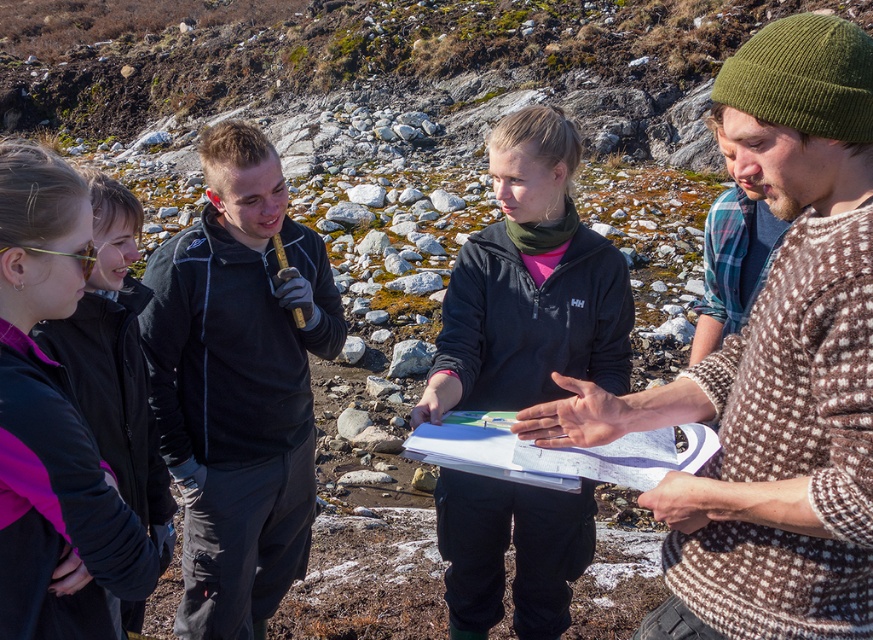
Question: Which of these objects is positioned closest to the gray rough rock at center?

Choices:
 (A) brown knitted hat at upper right
 (B) black fleece jacket at center

Answer: (B)

Question: Is black fleece jacket at center further to the viewer compared to dark blue fleece jacket at center?

Choices:
 (A) yes
 (B) no

Answer: (A)

Question: Can you confirm if brown knitted hat at upper right is wider than gray rough rock at center?

Choices:
 (A) yes
 (B) no

Answer: (A)

Question: Considering the real-world distances, which object is farthest from the dark blue fleece jacket at center?

Choices:
 (A) brown knitted hat at upper right
 (B) pink fabric jacket at upper left
 (C) gray rough rock at center
 (D) black fleece jacket at center

Answer: (C)

Question: Can you confirm if brown knitted hat at upper right is positioned above gray rough rock at center?

Choices:
 (A) no
 (B) yes

Answer: (B)

Question: Which of the following is the farthest from the observer?

Choices:
 (A) gray rough rock at center
 (B) pink fabric jacket at upper left
 (C) black fleece jacket at center

Answer: (A)